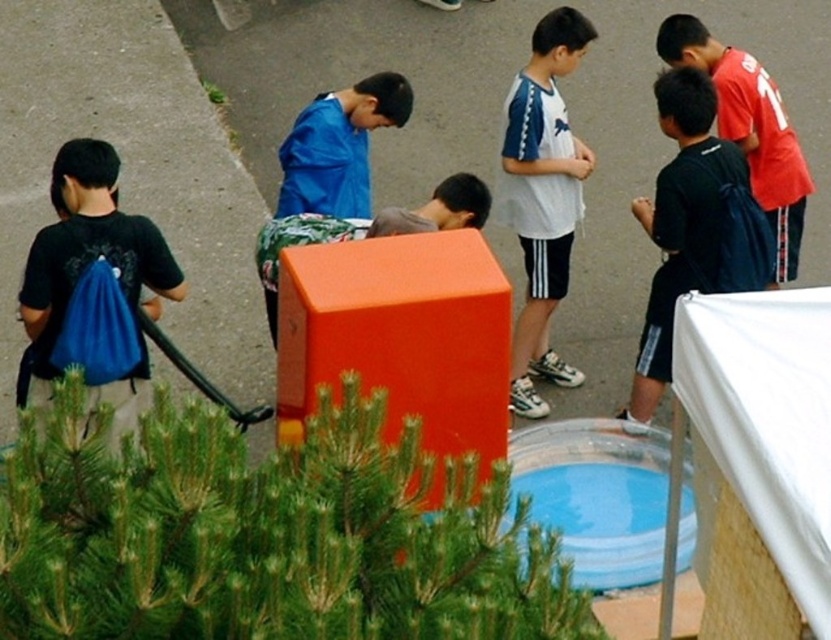
Is dark blue backpack at right behind red jersey at upper right?

No.

Locate an element on the screen. This screenshot has height=640, width=831. dark blue backpack at right is located at coordinates (692, 228).

Which is below, dark blue backpack at right or blue fabric backpack at left?

Positioned lower is blue fabric backpack at left.

Which is in front, point (766, 236) or point (117, 170)?

Point (117, 170) is in front.

Does point (766, 275) lie behind point (97, 243)?

Yes, point (766, 275) is farther from viewer.

Where is `dark blue backpack at right`? The width and height of the screenshot is (831, 640). dark blue backpack at right is located at coordinates (692, 228).

Between blue plastic pool at lower center and white matte shirt at center, which one has more height?

Standing taller between the two is white matte shirt at center.

Is blue plastic pool at lower center bigger than white matte shirt at center?

Actually, blue plastic pool at lower center might be smaller than white matte shirt at center.

Find the location of a particular element. blue plastic pool at lower center is located at coordinates (596, 497).

Where is `blue plastic pool at lower center`? blue plastic pool at lower center is located at coordinates (596, 497).